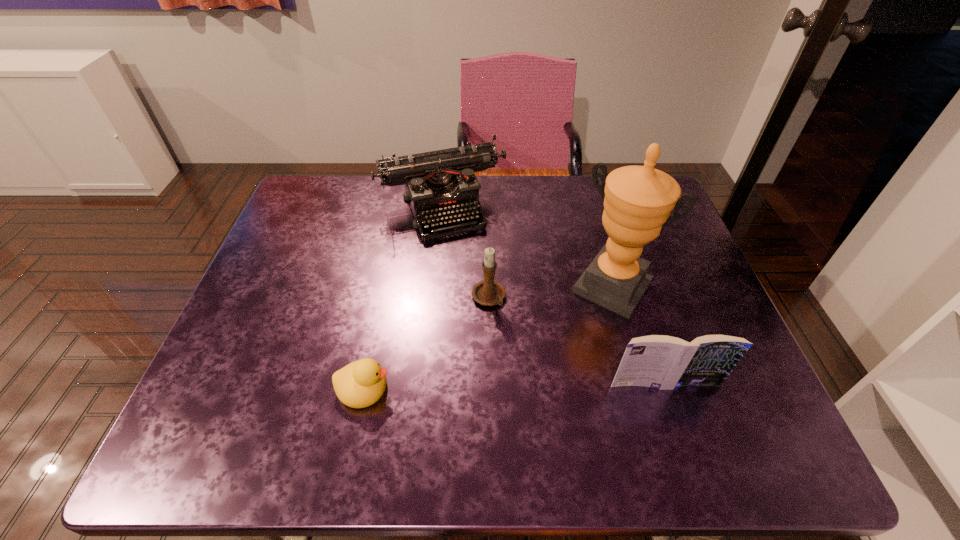
This screenshot has width=960, height=540. What are the coordinates of `vacant space that is in between the award and the book` in the screenshot? It's located at (638, 336).

The width and height of the screenshot is (960, 540). Identify the location of free space between the award and the duckling. (488, 338).

I want to click on free spot between the duckling and the typewriter, so click(x=403, y=298).

You are a GUI agent. You are given a task and a screenshot of the screen. Output one action in this format:
    pyautogui.click(x=<x>, y=<y>)
    Task: Click on the free space between the award and the shortest object
    The width and height of the screenshot is (960, 540).
    Given the screenshot: What is the action you would take?
    (x=488, y=338)

Identify the location of empty location between the candle holder and the shortest object. This screenshot has width=960, height=540. (426, 343).

At what (x,y) coordinates should I click in order to perform the action: click on vacant space that's between the candle holder and the farthest object. Please return your answer as a coordinate pair (x, y). This screenshot has width=960, height=540. Looking at the image, I should click on (466, 253).

Where is `free space between the tallest object and the candle holder`? The image size is (960, 540). free space between the tallest object and the candle holder is located at coordinates (550, 293).

At what (x,y) coordinates should I click in order to perform the action: click on object that is the fourth nearest to the award. Please return your answer as a coordinate pair (x, y). The image size is (960, 540). Looking at the image, I should click on (360, 384).

Point out which object is positioned as the nearest to the shortest object. Please provide its 2D coordinates. Your answer should be formatted as a tuple, i.e. [(x, y)], where the tuple contains the x and y coordinates of a point satisfying the conditions above.

[(489, 292)]